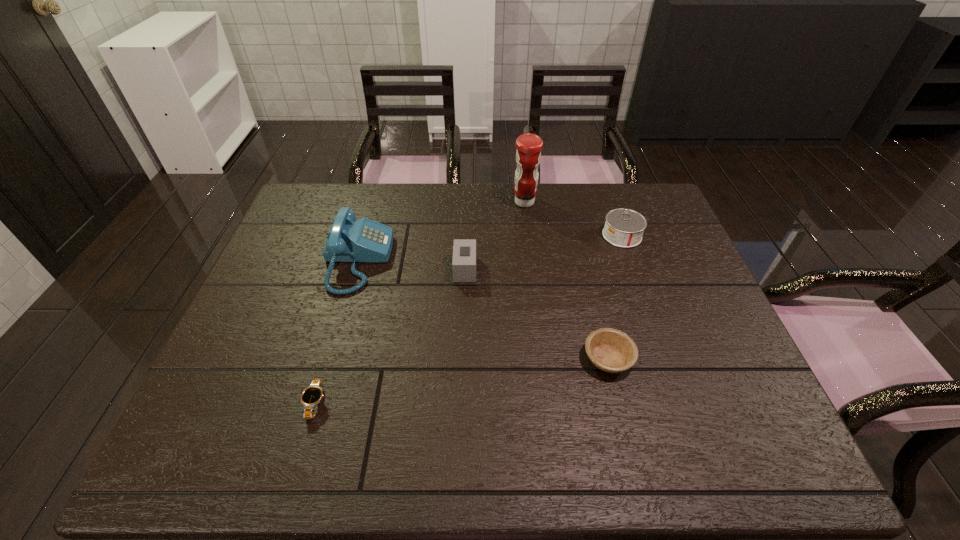
At what (x,y) coordinates should I click in order to perform the action: click on vacant space positioned 0.160m on the dial of the telephone. Please return your answer as a coordinate pair (x, y). Looking at the image, I should click on (445, 260).

This screenshot has height=540, width=960. I want to click on vacant space located on the front-facing side of the alarm clock, so click(x=596, y=269).

This screenshot has width=960, height=540. What are the coordinates of `vacant point located on the right of the can` in the screenshot? It's located at (667, 235).

Find the location of a particular element. This screenshot has height=540, width=960. vacant position located 0.110m on the left of the fifth object from left to right is located at coordinates (536, 359).

You are a GUI agent. You are given a task and a screenshot of the screen. Output one action in this format:
    pyautogui.click(x=<x>, y=<y>)
    Task: Click on the vacant space situated 0.140m on the back of the nearest object
    
    Given the screenshot: What is the action you would take?
    pyautogui.click(x=336, y=335)

Where is `condiment that is at the far edge`? Image resolution: width=960 pixels, height=540 pixels. condiment that is at the far edge is located at coordinates (528, 155).

At what (x,y) coordinates should I click in order to perform the action: click on can positioned at the far edge. Please return your answer as a coordinate pair (x, y). Looking at the image, I should click on (624, 228).

Where is `object that is at the left edge`? object that is at the left edge is located at coordinates (364, 240).

Locate an element on the screen. This screenshot has height=540, width=960. object situated at the right edge is located at coordinates (624, 228).

Find the location of a particular element. The height and width of the screenshot is (540, 960). object present at the far right corner is located at coordinates point(624,228).